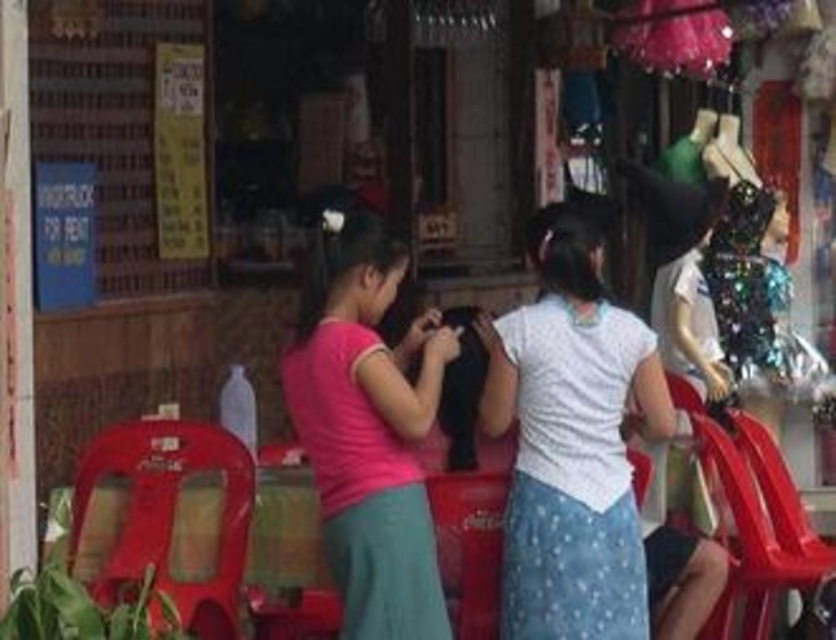
From the picture: Which of these two, white matte shirt at center or sparkly sequined dress at right, stands taller?

white matte shirt at center is taller.

Is white matte shirt at center above sparkly sequined dress at right?

Actually, white matte shirt at center is below sparkly sequined dress at right.

Which is in front, point (538, 460) or point (773, 198)?

Positioned in front is point (538, 460).

Where is `white matte shirt at center`? Image resolution: width=836 pixels, height=640 pixels. white matte shirt at center is located at coordinates 571,444.

Does white matte shirt at center have a greater height compared to matte plastic chair at lower left?

Indeed, white matte shirt at center has a greater height compared to matte plastic chair at lower left.

You are a GUI agent. You are given a task and a screenshot of the screen. Output one action in this format:
    pyautogui.click(x=<x>, y=<y>)
    Task: Click on the white matte shirt at center
    The height and width of the screenshot is (640, 836).
    Given the screenshot: What is the action you would take?
    pyautogui.click(x=571, y=444)

The image size is (836, 640). What do you see at coordinates (571, 444) in the screenshot? I see `white matte shirt at center` at bounding box center [571, 444].

The height and width of the screenshot is (640, 836). Find the location of `white matte shirt at center`. white matte shirt at center is located at coordinates (571, 444).

Does point (184, 580) come in front of point (788, 579)?

Yes, it is in front of point (788, 579).

Can you confirm if matte plastic chair at lower left is positioned below metallic red chair at lower right?

No, matte plastic chair at lower left is not below metallic red chair at lower right.

This screenshot has width=836, height=640. I want to click on matte plastic chair at lower left, so click(x=169, y=513).